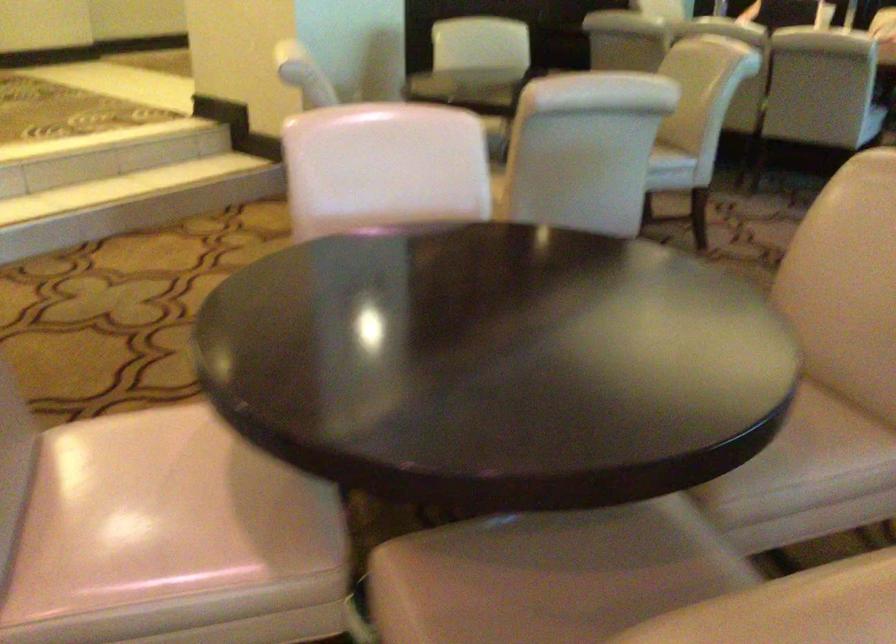
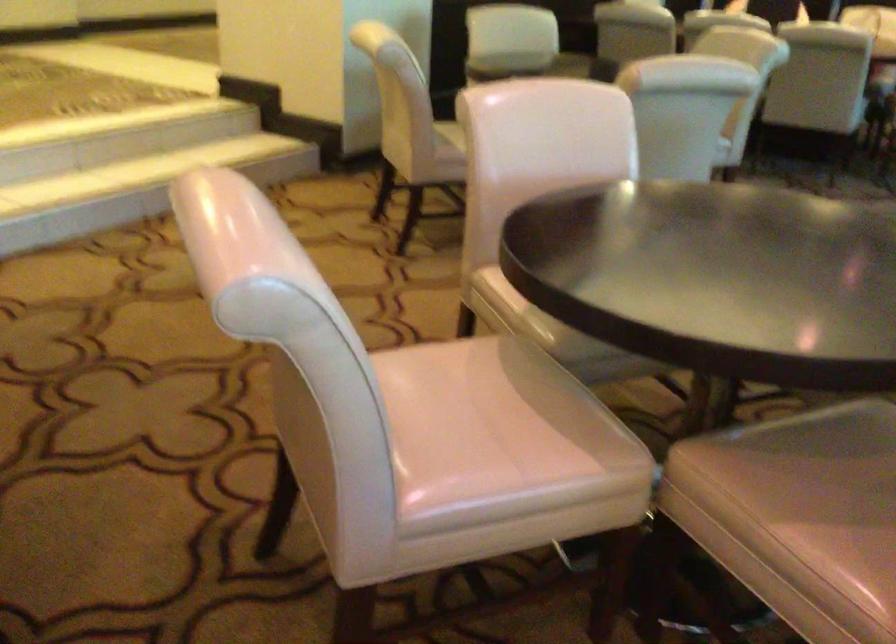
Question: The camera is either moving clockwise (left) or counter-clockwise (right) around the object. The first image is from the beginning of the video and the second image is from the end. Is the camera moving left or right when shooting the video?

Choices:
 (A) Left
 (B) Right

Answer: (A)